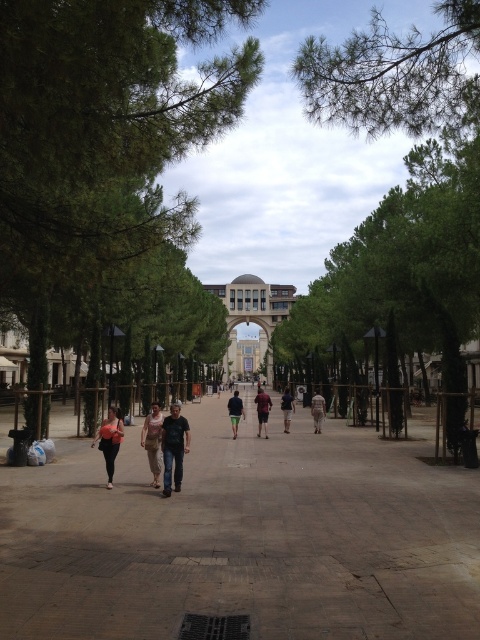
Between point (252, 593) and point (287, 394), which one is positioned behind?

Positioned behind is point (287, 394).

Can you confirm if brown concrete pavement at lower left is smaller than dark blue shirt at center?

Yes, brown concrete pavement at lower left is smaller than dark blue shirt at center.

Which is behind, point (78, 520) or point (288, 394)?

The point (288, 394) is more distant.

Where is `brown concrete pavement at lower left`? This screenshot has height=640, width=480. brown concrete pavement at lower left is located at coordinates (243, 538).

Is point (112, 435) positioned in front of point (156, 460)?

No, it is behind (156, 460).

From the picture: Does matte black pants at lower left have a larger size compared to beige cotton dress at center?

Actually, matte black pants at lower left might be smaller than beige cotton dress at center.

Is point (107, 484) behind point (147, 420)?

No, it is not.

Where is `matte black pants at lower left`? This screenshot has height=640, width=480. matte black pants at lower left is located at coordinates (109, 440).

Consider the image. Can you confirm if green leafy tree at center is positioned to the right of green needle-like branches at upper right?

No, green leafy tree at center is not to the right of green needle-like branches at upper right.

Is green leafy tree at center below green needle-like branches at upper right?

Correct, green leafy tree at center is located below green needle-like branches at upper right.

Who is more forward, (14, 196) or (418, 96)?

Point (14, 196) is in front.

Where is `green leafy tree at center`? The image size is (480, 640). green leafy tree at center is located at coordinates (103, 136).